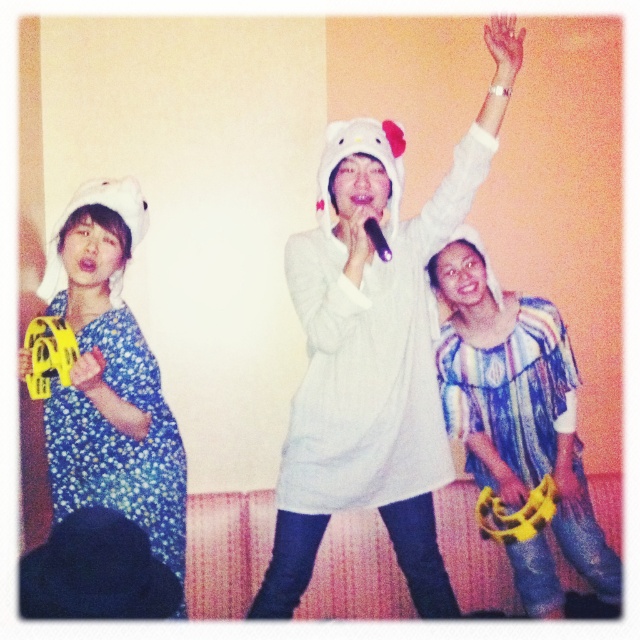
Is white plush hello kitty hat at center to the left of floral fabric dress at left from the viewer's perspective?

In fact, white plush hello kitty hat at center is to the right of floral fabric dress at left.

Is white plush hello kitty hat at center taller than floral fabric dress at left?

Yes, white plush hello kitty hat at center is taller than floral fabric dress at left.

The image size is (640, 640). I want to click on white plush hello kitty hat at center, so click(369, 365).

Can you confirm if striped cotton dress at center is positioned to the right of floral fabric dress at left?

Indeed, striped cotton dress at center is positioned on the right side of floral fabric dress at left.

Is point (465, 381) closer to viewer compared to point (154, 547)?

That is False.

Locate an element on the screen. The height and width of the screenshot is (640, 640). striped cotton dress at center is located at coordinates (516, 401).

In order to click on white plush hello kitty hat at center in this screenshot , I will do `click(369, 365)`.

Is point (404, 337) less distant than point (577, 564)?

Yes, point (404, 337) is in front of point (577, 564).

This screenshot has height=640, width=640. Describe the element at coordinates (369, 365) in the screenshot. I see `white plush hello kitty hat at center` at that location.

Find the location of a particular element. white plush hello kitty hat at center is located at coordinates (369, 365).